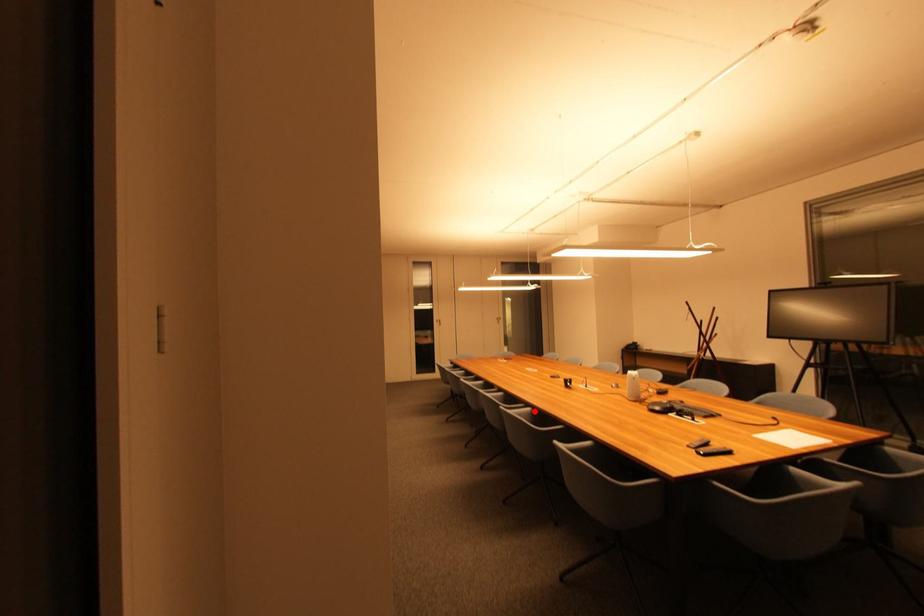
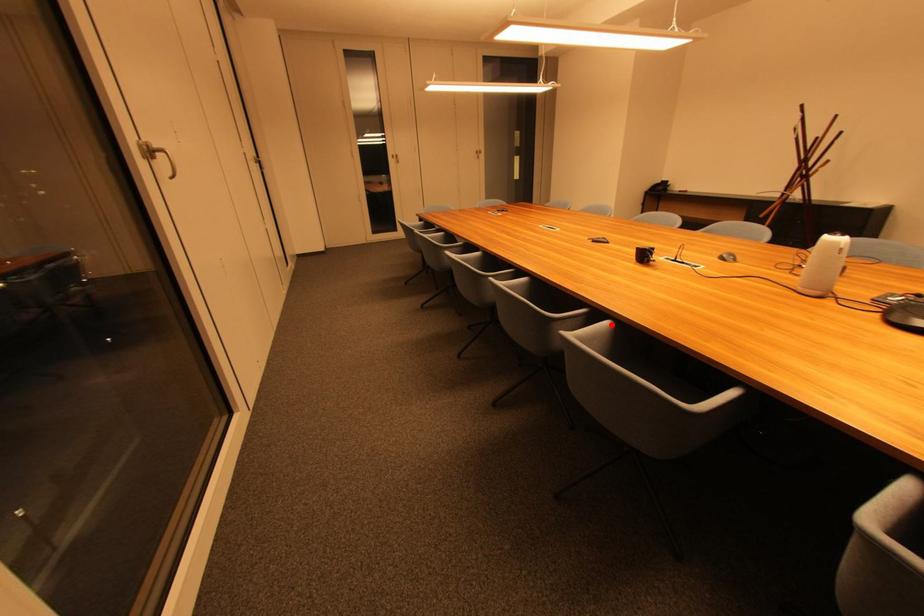
I am providing you with two images of the same scene from different viewpoints. A red point is marked on the first image and another point is marked on the second image. Do the highlighted points in image1 and image2 indicate the same real-world spot?

Yes